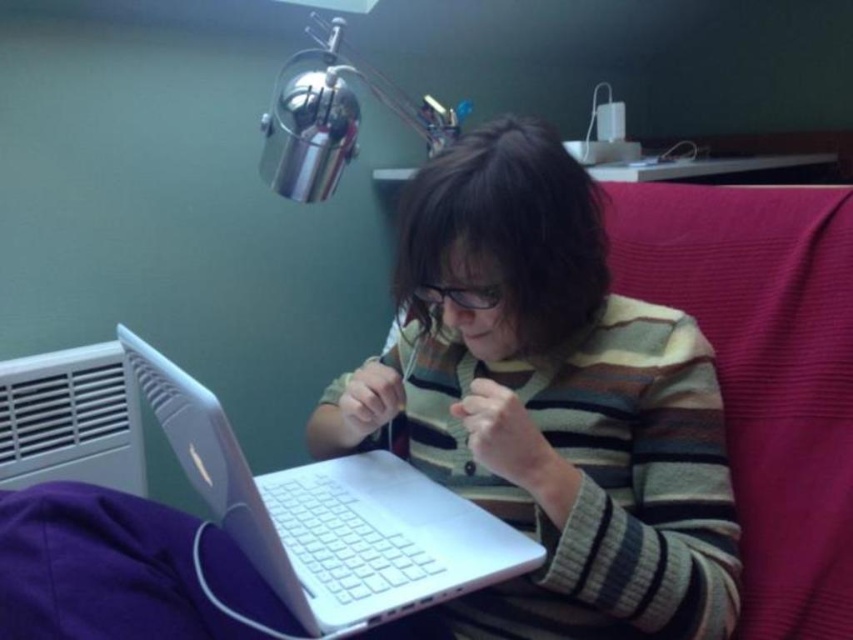
Between striped sweater at center and brushed metal lamp at upper center, which one has less height?

brushed metal lamp at upper center

Is striped sweater at center taller than brushed metal lamp at upper center?

Yes.

The width and height of the screenshot is (853, 640). I want to click on striped sweater at center, so click(x=552, y=403).

Based on the photo, is striped sweater at center thinner than white plastic laptop at center?

No, striped sweater at center is not thinner than white plastic laptop at center.

How far apart are striped sweater at center and white plastic laptop at center?

A distance of 6.74 inches exists between striped sweater at center and white plastic laptop at center.

Does point (703, 397) come farther from viewer compared to point (439, 589)?

Yes, point (703, 397) is farther from viewer.

In order to click on striped sweater at center in this screenshot , I will do `click(552, 403)`.

You are a GUI agent. You are given a task and a screenshot of the screen. Output one action in this format:
    pyautogui.click(x=<x>, y=<y>)
    Task: Click on the white plastic laptop at center
    This screenshot has height=640, width=853.
    Given the screenshot: What is the action you would take?
    tap(329, 515)

Between white plastic laptop at center and brushed metal lamp at upper center, which one appears on the left side from the viewer's perspective?

white plastic laptop at center is more to the left.

Which is behind, point (392, 570) or point (317, 90)?

The point (317, 90) is more distant.

What are the coordinates of `white plastic laptop at center` in the screenshot? It's located at (329, 515).